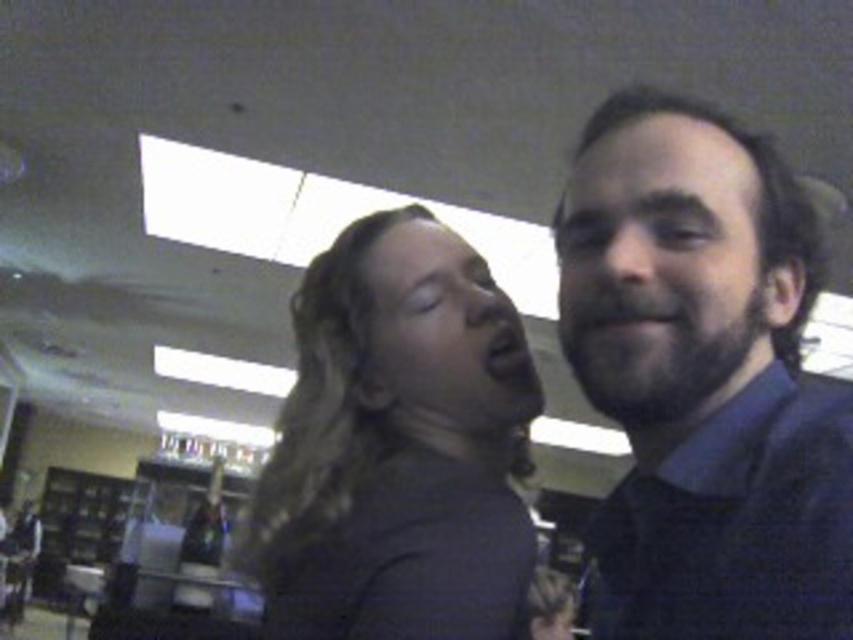
Question: Among these points, which one is nearest to the camera?

Choices:
 (A) (271, 620)
 (B) (752, 454)

Answer: (B)

Question: Among these points, which one is farthest from the camera?

Choices:
 (A) (801, 280)
 (B) (442, 596)

Answer: (A)

Question: Is dark blue shirt at right bigger than dark brown hair at center?

Choices:
 (A) no
 (B) yes

Answer: (A)

Question: Observing the image, what is the correct spatial positioning of dark blue shirt at right in reference to dark brown hair at center?

Choices:
 (A) below
 (B) above

Answer: (B)

Question: Can you confirm if dark blue shirt at right is positioned to the left of dark brown hair at center?

Choices:
 (A) no
 (B) yes

Answer: (A)